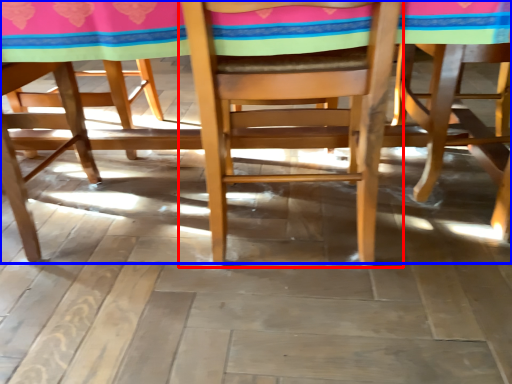
Question: Which point is further to the camera, chair (highlighted by a red box) or table (highlighted by a blue box)?

Choices:
 (A) chair
 (B) table

Answer: (B)